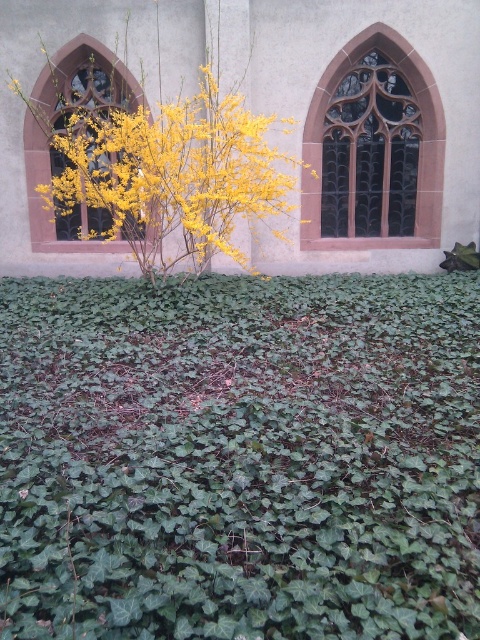
Question: Which object appears closest to the camera in this image?

Choices:
 (A) yellow matte flower at center
 (B) matte glass window at center
 (C) dark glass window at upper center
 (D) green leafy ivy at center

Answer: (D)

Question: Is green leafy ivy at center thinner than dark glass window at upper center?

Choices:
 (A) no
 (B) yes

Answer: (A)

Question: In this image, where is yellow matte flower at center located relative to dark glass window at upper center?

Choices:
 (A) below
 (B) above

Answer: (A)

Question: Does green leafy ivy at center appear under yellow matte flower at center?

Choices:
 (A) no
 (B) yes

Answer: (B)

Question: Which of the following is the farthest from the observer?

Choices:
 (A) (103, 168)
 (B) (434, 124)
 (C) (101, 52)
 (D) (402, 387)

Answer: (B)

Question: Estimate the real-world distances between objects in this image. Which object is closer to the yellow matte flower at center?

Choices:
 (A) green leafy ivy at center
 (B) matte glass window at center

Answer: (B)